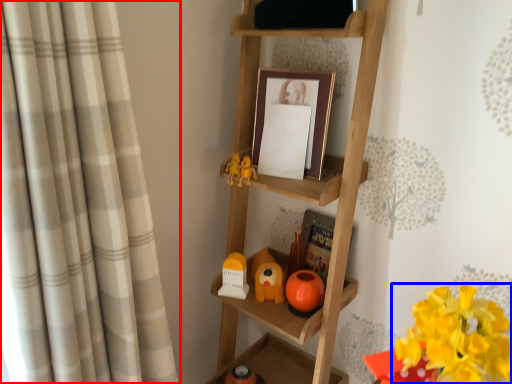
Question: Which of the following is the closest to the observer, curtain (highlighted by a red box) or flower (highlighted by a blue box)?

Choices:
 (A) curtain
 (B) flower

Answer: (A)